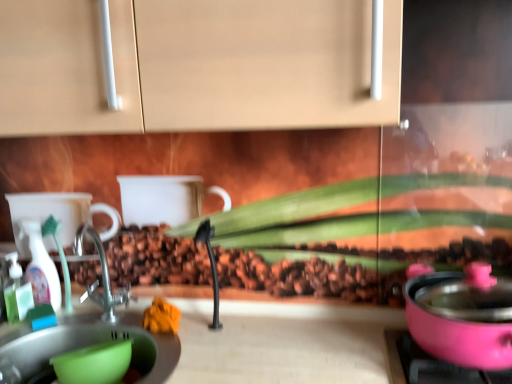
Question: Does translucent plastic spray bottle at left have a greater width compared to green plastic bowl at lower left?

Choices:
 (A) no
 (B) yes

Answer: (A)

Question: Considering the relative positions of translucent plastic spray bottle at left and green plastic bowl at lower left in the image provided, is translucent plastic spray bottle at left to the right of green plastic bowl at lower left from the viewer's perspective?

Choices:
 (A) no
 (B) yes

Answer: (A)

Question: From the image's perspective, is translucent plastic spray bottle at left beneath green plastic bowl at lower left?

Choices:
 (A) no
 (B) yes

Answer: (A)

Question: From a real-world perspective, does translucent plastic spray bottle at left stand above green plastic bowl at lower left?

Choices:
 (A) no
 (B) yes

Answer: (B)

Question: Does translucent plastic spray bottle at left touch green plastic bowl at lower left?

Choices:
 (A) no
 (B) yes

Answer: (A)

Question: Would you say translucent plastic spray bottle at left contains green plastic bowl at lower left?

Choices:
 (A) yes
 (B) no

Answer: (B)

Question: From a real-world perspective, is green plastic bowl at lower left on translucent plastic spray bottle at left?

Choices:
 (A) yes
 (B) no

Answer: (B)

Question: Can you confirm if green plastic bowl at lower left is smaller than translucent plastic spray bottle at left?

Choices:
 (A) no
 (B) yes

Answer: (A)

Question: Can you confirm if green plastic bowl at lower left is positioned to the right of translucent plastic spray bottle at left?

Choices:
 (A) yes
 (B) no

Answer: (A)

Question: Is green plastic bowl at lower left thinner than translucent plastic spray bottle at left?

Choices:
 (A) yes
 (B) no

Answer: (B)

Question: Does green plastic bowl at lower left have a greater width compared to translucent plastic spray bottle at left?

Choices:
 (A) no
 (B) yes

Answer: (B)

Question: Can translucent plastic spray bottle at left be found inside green plastic bowl at lower left?

Choices:
 (A) yes
 (B) no

Answer: (B)

Question: From a real-world perspective, relative to green plastic bowl at lower left, is translucent plastic spray bottle at left vertically above or below?

Choices:
 (A) above
 (B) below

Answer: (A)